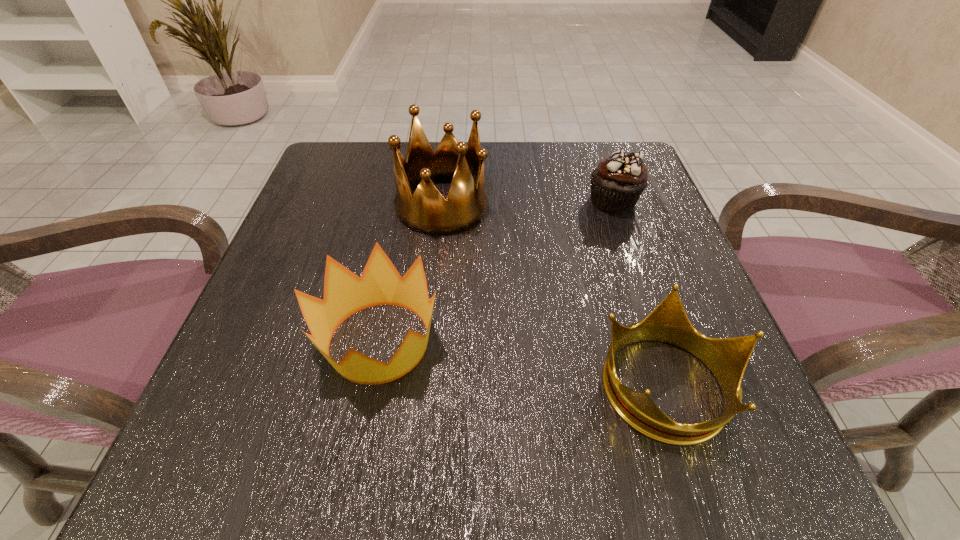
The width and height of the screenshot is (960, 540). Identify the location of the farthest crown. (426, 211).

At what (x,y) coordinates should I click in order to perform the action: click on the tallest crown. Please return your answer as a coordinate pair (x, y). The width and height of the screenshot is (960, 540). Looking at the image, I should click on [426, 211].

The image size is (960, 540). What are the coordinates of `cupcake` in the screenshot? It's located at (616, 184).

The width and height of the screenshot is (960, 540). I want to click on the rightmost crown, so click(727, 358).

The height and width of the screenshot is (540, 960). I want to click on free space located on the front of the farthest crown, so click(425, 373).

Find the location of a particular element. free space located on the left of the cupcake is located at coordinates tap(432, 201).

Find the location of a particular element. free space located 0.190m on the left of the rightmost crown is located at coordinates (464, 384).

You are a GUI agent. You are given a task and a screenshot of the screen. Output one action in this format:
    pyautogui.click(x=<x>, y=<y>)
    Task: Click on the crown at the far edge
    The height and width of the screenshot is (540, 960).
    Given the screenshot: What is the action you would take?
    pyautogui.click(x=426, y=211)

Where is `cupcake that is at the far edge`? cupcake that is at the far edge is located at coordinates (616, 184).

Identify the location of object that is at the near edge. (727, 358).